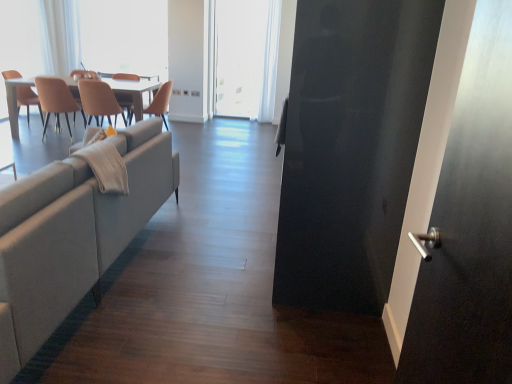
I want to click on vacant region in front of glossy black screen door at right, so click(x=308, y=338).